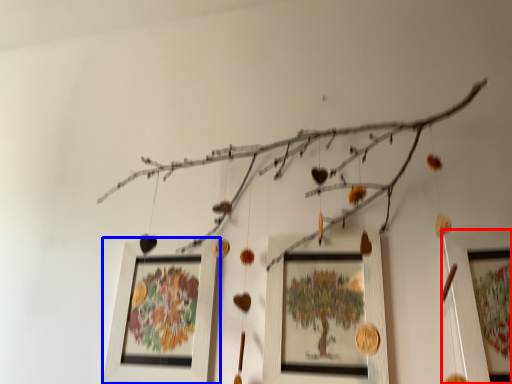
Question: Which object is closer to the camera taking this photo, picture frame (highlighted by a red box) or picture frame (highlighted by a blue box)?

Choices:
 (A) picture frame
 (B) picture frame

Answer: (A)